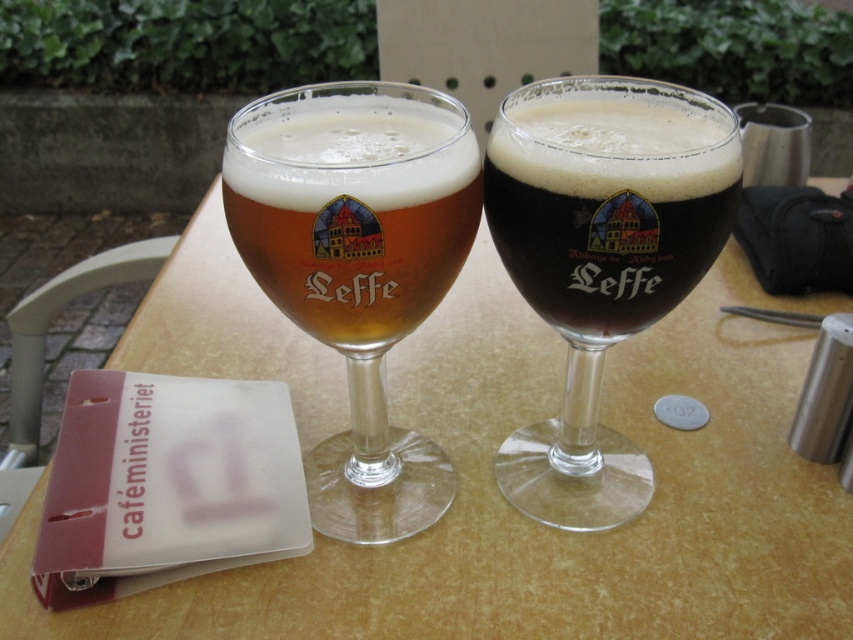
The image size is (853, 640). I want to click on dark brown glass at center, so click(601, 259).

Is dark brown glass at center in front of translucent glass beer glass at center?

No, dark brown glass at center is behind translucent glass beer glass at center.

Describe the element at coordinates (601, 259) in the screenshot. The image size is (853, 640). I see `dark brown glass at center` at that location.

In order to click on dark brown glass at center in this screenshot , I will do `click(601, 259)`.

The width and height of the screenshot is (853, 640). In order to click on wooden table at center in this screenshot , I will do `click(538, 524)`.

This screenshot has width=853, height=640. Describe the element at coordinates (538, 524) in the screenshot. I see `wooden table at center` at that location.

Who is more distant from viewer, (838, 568) or (393, 227)?

Point (838, 568)

Find the location of a particular element. The image size is (853, 640). wooden table at center is located at coordinates (538, 524).

Does wooden table at center have a larger size compared to dark brown glass at center?

Yes.

From the picture: Measure the distance between wooden table at center and dark brown glass at center.

wooden table at center and dark brown glass at center are 5.30 inches apart from each other.

Which is behind, point (424, 330) or point (512, 273)?

Positioned behind is point (424, 330).

Locate an element on the screen. The image size is (853, 640). wooden table at center is located at coordinates (538, 524).